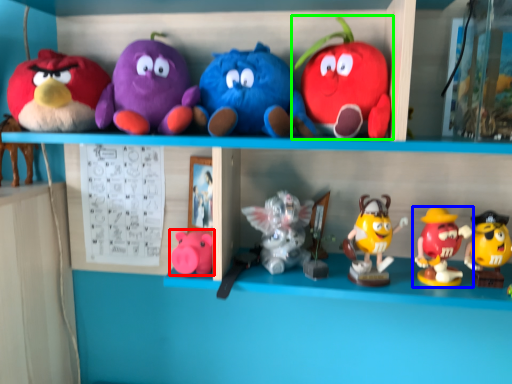
Question: Which object is the closest to the toy (highlighted by a red box)? Choose among these: toy (highlighted by a blue box) or toy (highlighted by a green box).

Choices:
 (A) toy
 (B) toy

Answer: (B)